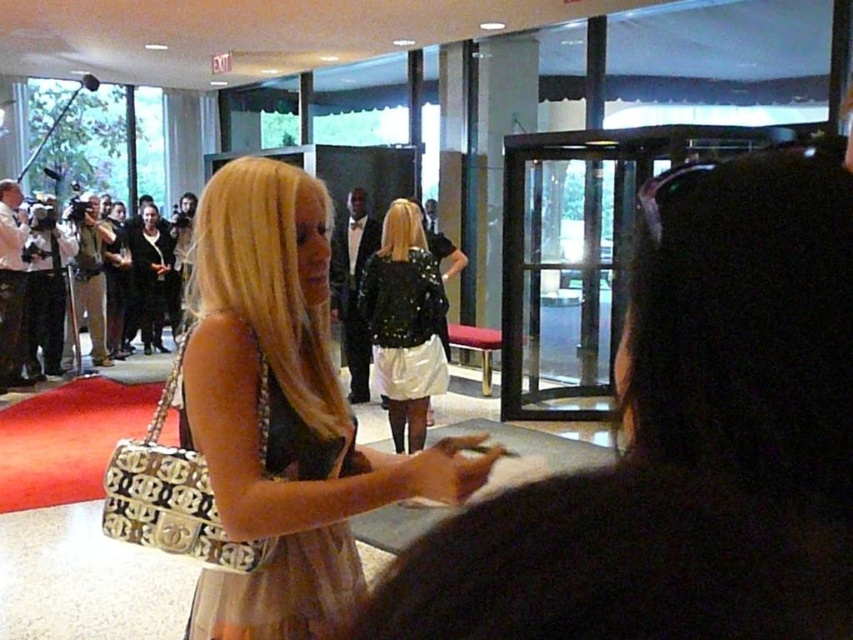
Which is in front, point (643, 419) or point (274, 458)?

Point (643, 419)

Locate an element on the screen. This screenshot has width=853, height=640. black sequined jacket at center is located at coordinates (683, 444).

Can you confirm if black satin dress at center is bigger than sequined black jacket at center?

No, black satin dress at center is not bigger than sequined black jacket at center.

Who is more distant from viewer, (318, 477) or (416, 408)?

Point (416, 408)

Is point (206, 355) in front of point (378, 336)?

That is True.

This screenshot has height=640, width=853. I want to click on black satin dress at center, so click(x=267, y=499).

Between black sequined jacket at center and sequined black jacket at center, which one appears on the left side from the viewer's perspective?

Positioned to the left is sequined black jacket at center.

Is the position of black sequined jacket at center less distant than that of sequined black jacket at center?

Yes, black sequined jacket at center is in front of sequined black jacket at center.

Who is more forward, (479,586) or (418,289)?

Positioned in front is point (479,586).

Where is `black sequined jacket at center`? black sequined jacket at center is located at coordinates (683, 444).